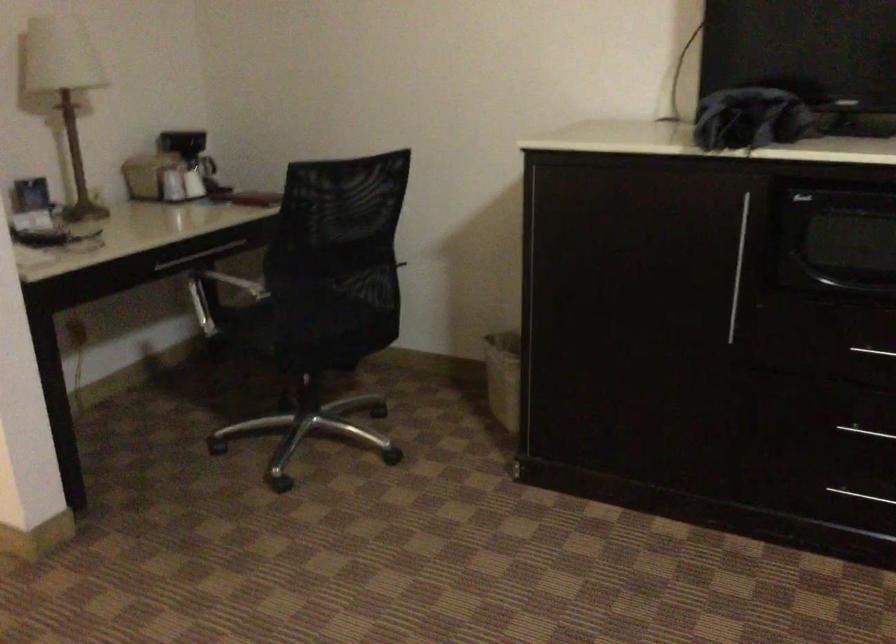
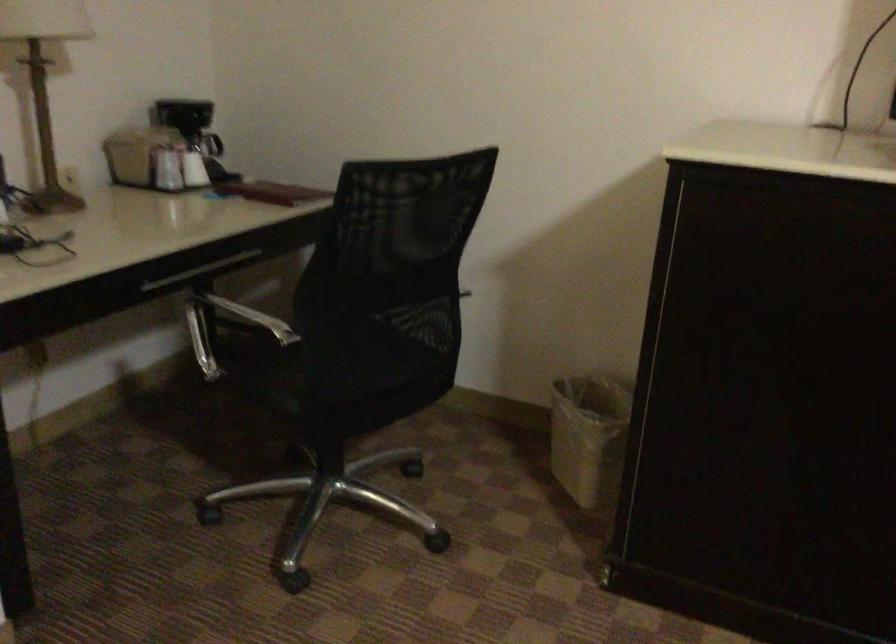
In a continuous first-person perspective shot, in which direction is the camera moving?

The movement direction of the cameraman is left, forward.